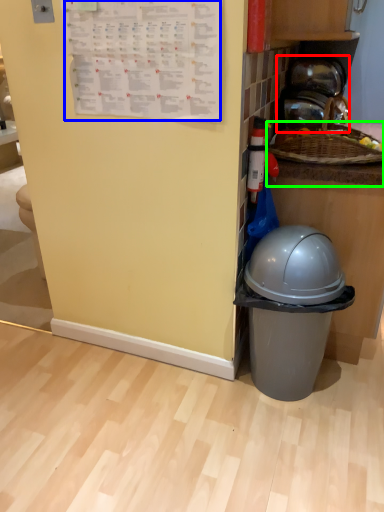
Question: Which object is positioned farthest from appliance (highlighted by a red box)? Select from writing (highlighted by a blue box) and counter top (highlighted by a green box).

Choices:
 (A) writing
 (B) counter top

Answer: (A)